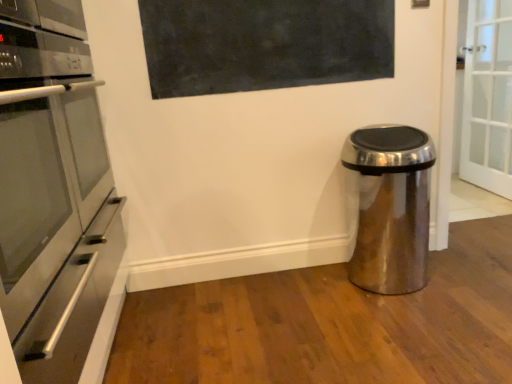
The width and height of the screenshot is (512, 384). I want to click on free space to the left of satin metallic trash can at lower right, so click(316, 292).